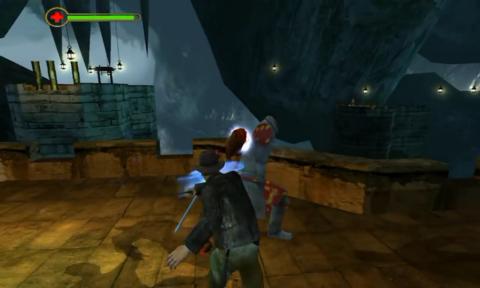
Image resolution: width=480 pixels, height=288 pixels. I want to click on floor, so click(x=81, y=250).